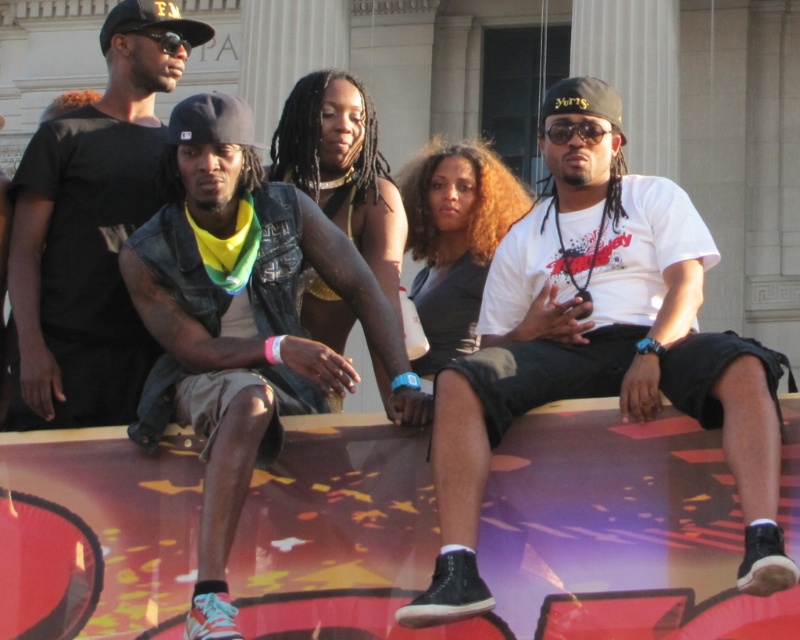
You are standing at the center of the stage and want to move towards the edge closest to the building with the classical columns. Which point, point [142,412] or point [64,138], is closer to the edge of the stage facing the building?

Point [142,412] is closer to the edge of the stage facing the building because it is in front of point [64,138], meaning it is positioned closer to the front edge near the building.